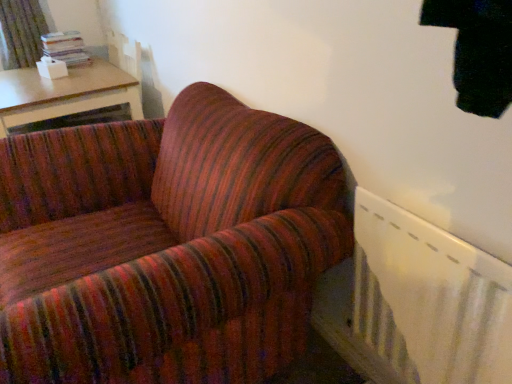
Question: Does green textured curtain at upper left have a larger size compared to white plastic radiator at lower right?

Choices:
 (A) no
 (B) yes

Answer: (B)

Question: Does green textured curtain at upper left appear on the right side of white plastic radiator at lower right?

Choices:
 (A) no
 (B) yes

Answer: (A)

Question: Is white plastic radiator at lower right inside green textured curtain at upper left?

Choices:
 (A) no
 (B) yes

Answer: (A)

Question: Could you tell me if green textured curtain at upper left is turned towards white plastic radiator at lower right?

Choices:
 (A) no
 (B) yes

Answer: (B)

Question: Considering the relative sizes of green textured curtain at upper left and white plastic radiator at lower right in the image provided, is green textured curtain at upper left wider than white plastic radiator at lower right?

Choices:
 (A) no
 (B) yes

Answer: (B)

Question: Is green textured curtain at upper left not inside white plastic radiator at lower right?

Choices:
 (A) no
 (B) yes

Answer: (B)

Question: Can you confirm if white plastic radiator at lower right is smaller than wooden table at upper left?

Choices:
 (A) no
 (B) yes

Answer: (B)

Question: Does white plastic radiator at lower right appear on the right side of wooden table at upper left?

Choices:
 (A) yes
 (B) no

Answer: (A)

Question: Considering the relative sizes of white plastic radiator at lower right and wooden table at upper left in the image provided, is white plastic radiator at lower right shorter than wooden table at upper left?

Choices:
 (A) no
 (B) yes

Answer: (A)

Question: From the image's perspective, is white plastic radiator at lower right over wooden table at upper left?

Choices:
 (A) yes
 (B) no

Answer: (B)

Question: Is white plastic radiator at lower right positioned far away from wooden table at upper left?

Choices:
 (A) yes
 (B) no

Answer: (A)

Question: Is wooden table at upper left located within white plastic radiator at lower right?

Choices:
 (A) no
 (B) yes

Answer: (A)

Question: Can white plastic radiator at lower right be found inside wooden table at upper left?

Choices:
 (A) yes
 (B) no

Answer: (B)